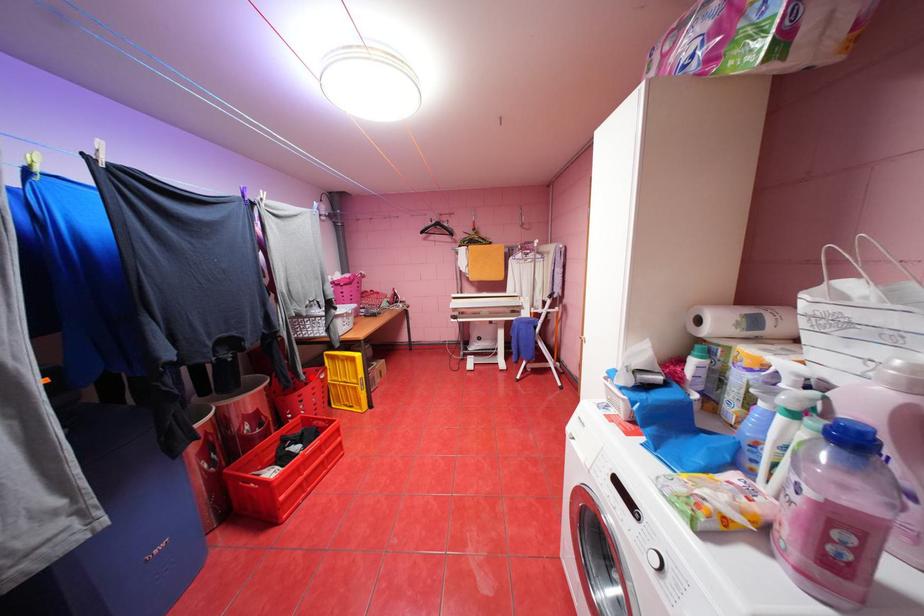
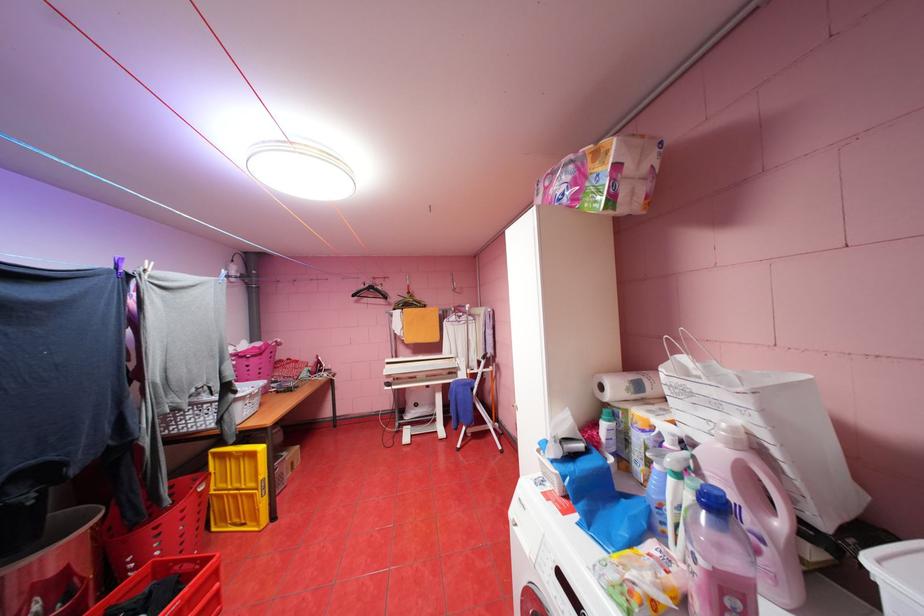
Question: I am providing you with two images of the same scene from different viewpoints. Given a red point in image1, look at the same physical point in image2. Is it:

Choices:
 (A) Closer to the viewpoint
 (B) Farther from the viewpoint

Answer: (B)